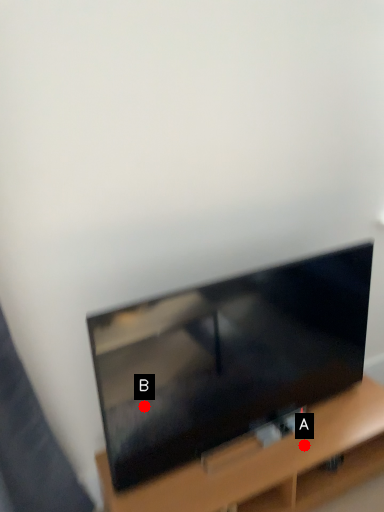
Question: Two points are circled on the image, labeled by A and B beside each circle. Which point appears closest to the camera in this image?

Choices:
 (A) A is closer
 (B) B is closer

Answer: (B)